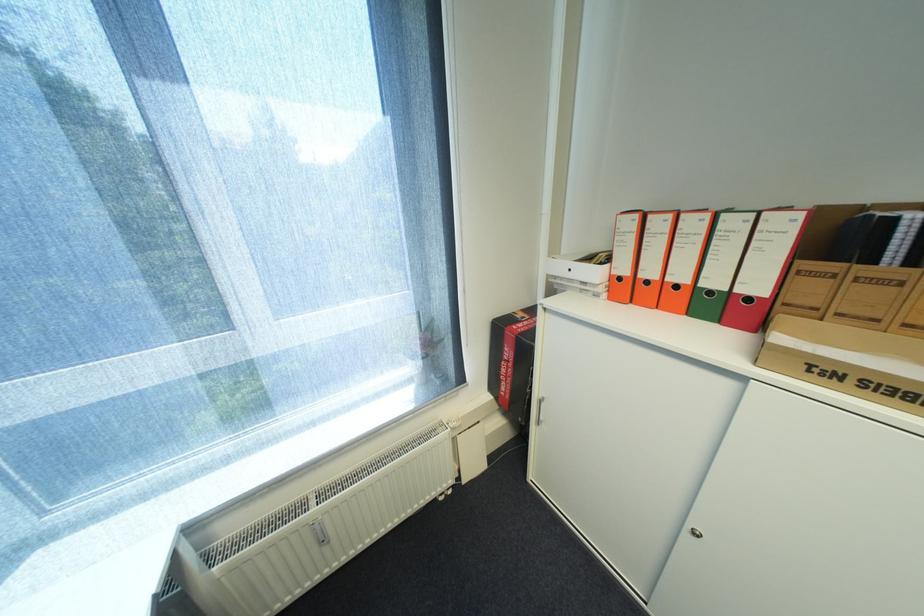
This screenshot has width=924, height=616. I want to click on radiator thermostat knob, so click(x=320, y=533).